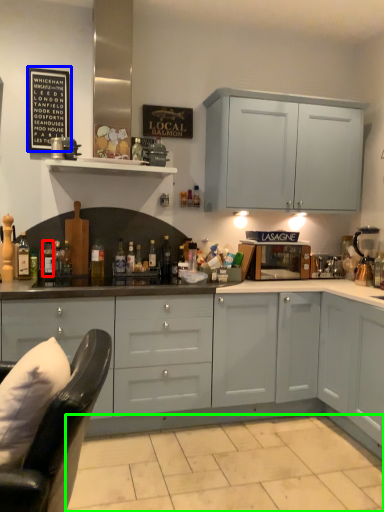
Question: Based on their relative distances, which object is nearer to bottle (highlighted by a red box)? Choose from bulletin board (highlighted by a blue box) and tile (highlighted by a green box).

Choices:
 (A) bulletin board
 (B) tile

Answer: (A)